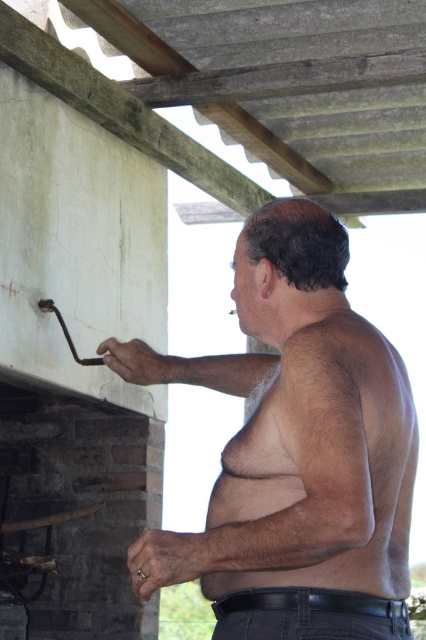
You are a construction inspector examining the brick structure. You notice a shiny metallic tool at upper left marked by point (296, 451). What is the position of this tool relative to the brick structure?

The shiny metallic tool at upper left marked by point (296, 451) is positioned at the upper left of the brick structure.